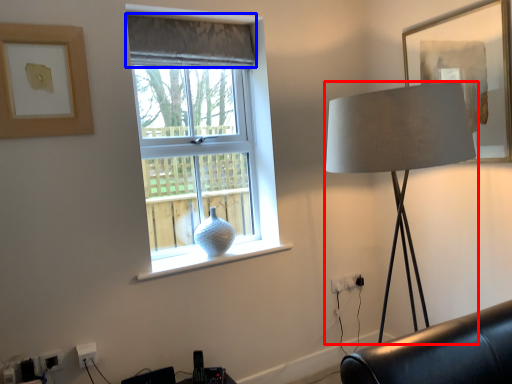
Question: Which of the following is the closest to the observer, lamp (highlighted by a red box) or curtain (highlighted by a blue box)?

Choices:
 (A) lamp
 (B) curtain

Answer: (A)